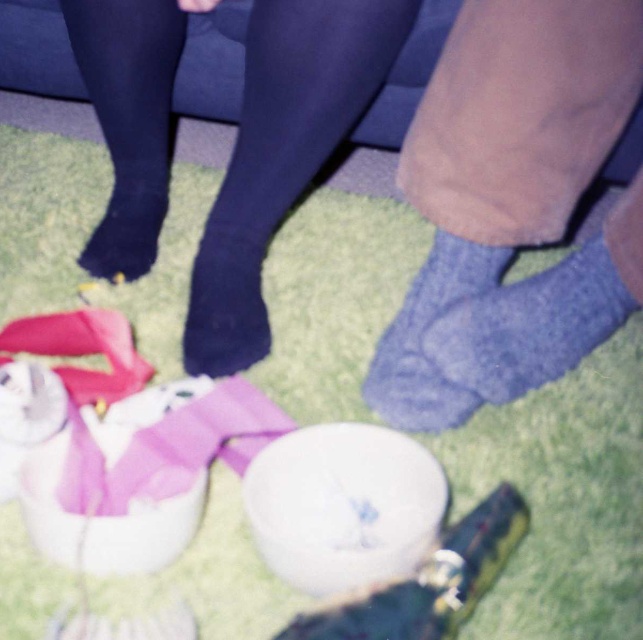
How distant is black smooth tights at center from blue knitted sock at lower right?

black smooth tights at center and blue knitted sock at lower right are 11.32 inches apart.

Does black smooth tights at center appear on the right side of blue knitted sock at lower right?

In fact, black smooth tights at center is to the left of blue knitted sock at lower right.

Looking at this image, who is more distant from viewer, (242, 228) or (451, 316)?

The point (242, 228) is more distant.

Where is `black smooth tights at center`? black smooth tights at center is located at coordinates (282, 154).

Based on the photo, is blue knitted socks at lower right to the left of black smooth tights at center from the viewer's perspective?

In fact, blue knitted socks at lower right is to the right of black smooth tights at center.

Can you confirm if blue knitted socks at lower right is shorter than black smooth tights at center?

Yes.

Where is `blue knitted socks at lower right`? blue knitted socks at lower right is located at coordinates (512, 205).

In the scene shown: Can you confirm if blue knitted socks at lower right is taller than blue knitted sock at lower right?

Yes, blue knitted socks at lower right is taller than blue knitted sock at lower right.

Between blue knitted socks at lower right and blue knitted sock at lower right, which one has more height?

blue knitted socks at lower right

Find the location of a particular element. The width and height of the screenshot is (643, 640). blue knitted socks at lower right is located at coordinates (512, 205).

You are a GUI agent. You are given a task and a screenshot of the screen. Output one action in this format:
    pyautogui.click(x=<x>, y=<y>)
    Task: Click on the blue knitted socks at lower right
    This screenshot has width=643, height=640.
    Given the screenshot: What is the action you would take?
    click(512, 205)